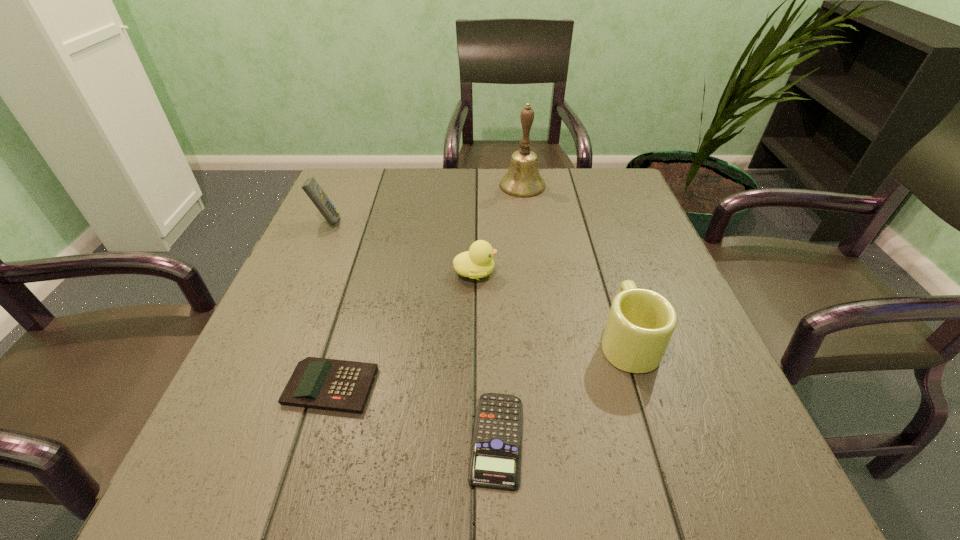
Where is `calculator that is at the far edge`? The width and height of the screenshot is (960, 540). calculator that is at the far edge is located at coordinates (311, 187).

This screenshot has width=960, height=540. What are the coordinates of `object positioned at the near edge` in the screenshot? It's located at (495, 460).

Locate an element on the screen. object positioned at the right edge is located at coordinates (641, 322).

In order to click on object that is positioned at the far left corner in this screenshot , I will do `click(311, 187)`.

I want to click on vacant space at the far edge, so click(422, 188).

Locate an element on the screen. This screenshot has width=960, height=540. free space at the near edge is located at coordinates (386, 462).

In the image, there is a desktop. Find the location of `vacant space at the left edge`. vacant space at the left edge is located at coordinates (344, 219).

Image resolution: width=960 pixels, height=540 pixels. Find the location of `blank space at the right edge of the desktop`. blank space at the right edge of the desktop is located at coordinates (666, 374).

This screenshot has height=540, width=960. What are the coordinates of `vacant space at the far right corner of the desktop` in the screenshot? It's located at (575, 173).

The height and width of the screenshot is (540, 960). In the image, there is a desktop. What are the coordinates of `vacant space at the near right corner` in the screenshot? It's located at (659, 463).